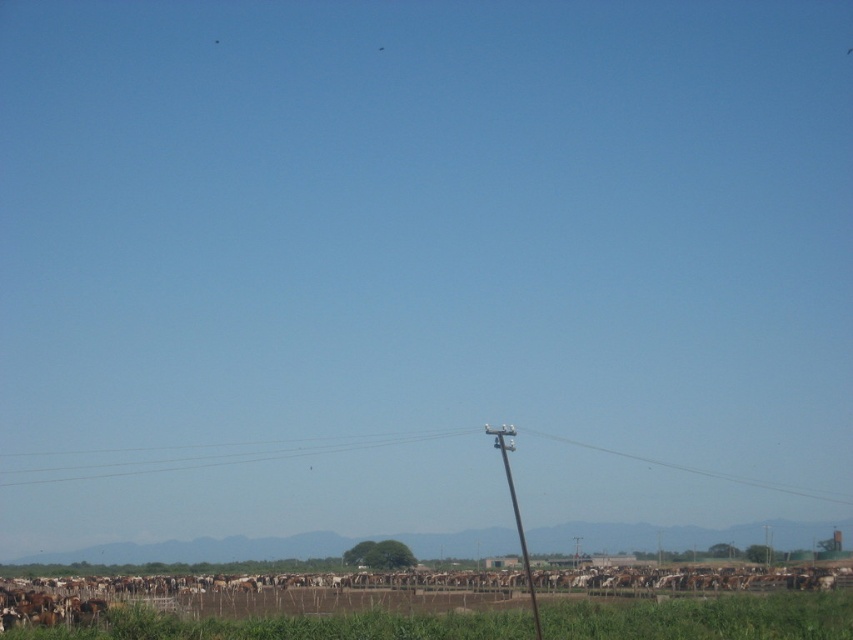
Is green grass at lower center bigger than smooth wire at center?

Incorrect, green grass at lower center is not larger than smooth wire at center.

Does green grass at lower center have a greater height compared to smooth wire at center?

In fact, green grass at lower center may be shorter than smooth wire at center.

The width and height of the screenshot is (853, 640). What are the coordinates of `green grass at lower center` in the screenshot? It's located at (705, 618).

From the picture: Does smooth wire at center come in front of brown wooden telegraph pole at center?

No, it is not.

Where is `smooth wire at center`? smooth wire at center is located at coordinates (210, 456).

Which is in front, point (335, 618) or point (529, 577)?

Point (335, 618) is more forward.

Which of these two, green grass at lower center or brown wooden telegraph pole at center, stands shorter?

Standing shorter between the two is green grass at lower center.

Is point (392, 616) closer to viewer compared to point (531, 577)?

Yes, point (392, 616) is closer to viewer.

Image resolution: width=853 pixels, height=640 pixels. I want to click on green grass at lower center, so click(x=705, y=618).